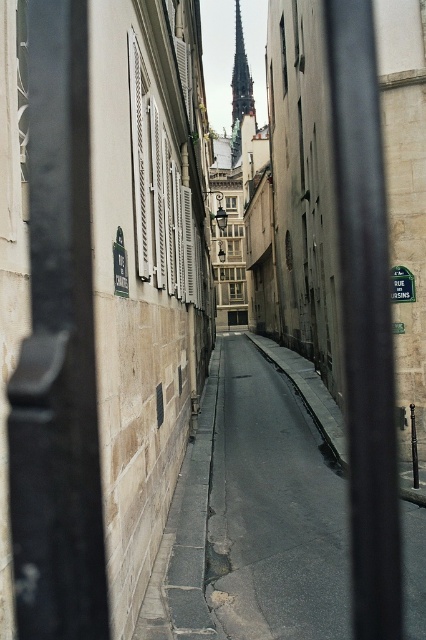
You are a tourist holding a map and looking down the cobblestone street. You see the smooth gray stone spire at upper center and the green plastic street sign at center. Which object is closer to you?

The smooth gray stone spire at upper center is closer to you because the green plastic street sign at center is behind it.

You are a tourist holding a camera and want to take a photo of the smooth gray stone spire at upper center and the green plastic street sign at center. Which object should you focus on first if you want both to be in clear focus?

The smooth gray stone spire at upper center is taller than the green plastic street sign at center, so you should focus on the smooth gray stone spire at upper center first to ensure both are in clear focus.

You are a tourist standing in front of the two vertical black metal bars looking down the narrow cobblestone street. You notice the smooth gray stone spire at upper center and the green plastic street sign at center. Which object is positioned higher in the scene?

The smooth gray stone spire at upper center is positioned higher than the green plastic street sign at center.